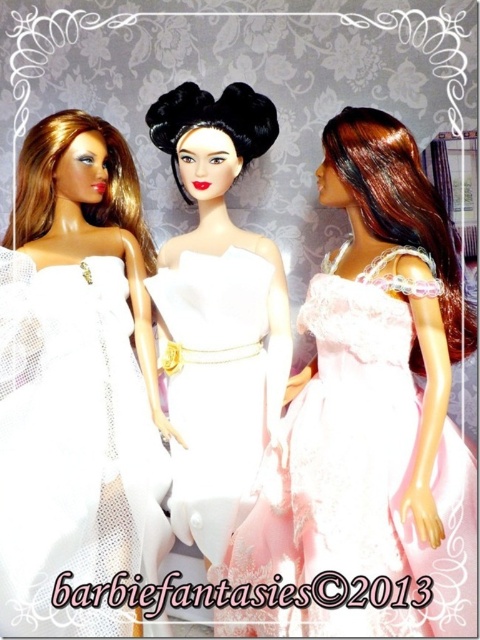
Consider the image. You are a doll collector examining the three dolls displayed against the floral wallpaper. You notice the pink lace dress at center and the white mesh dress at center. Which of these two dresses has a greater width?

The pink lace dress at center has a greater width than the white mesh dress at center according to the description.